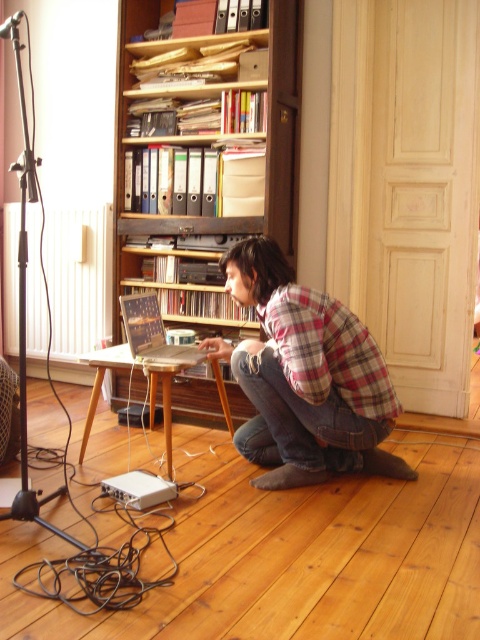
You are a photographer trying to set up a camera to capture the person working on the laptop. The camera must be placed exactly 3 meters away from the wooden bookshelf at upper center. Is the current position of the camera suitable for this requirement?

The wooden bookshelf at upper center and camera are 3.02 meters apart, so the camera is slightly further than 3 meters away. To meet the requirement, the camera should be moved about 2 centimeters closer to the wooden bookshelf at upper center.

You are a delivery person who needs to place a package on the wooden bookshelf at upper center. The package is 1 meter wide. Can you fit it on the bookshelf?

The wooden bookshelf at upper center is located at point (206, 148), but the description does not provide its dimensions. Therefore, it is impossible to determine if the package will fit.

You are a tailor who needs to measure the plaid flannel shirt at center and the wooden laptop at center to ensure they fit into a storage box. Which object is taller?

The plaid flanel shirt at center has a greater height compared to the wooden laptop at center, so the plaid flanel shirt at center is taller.